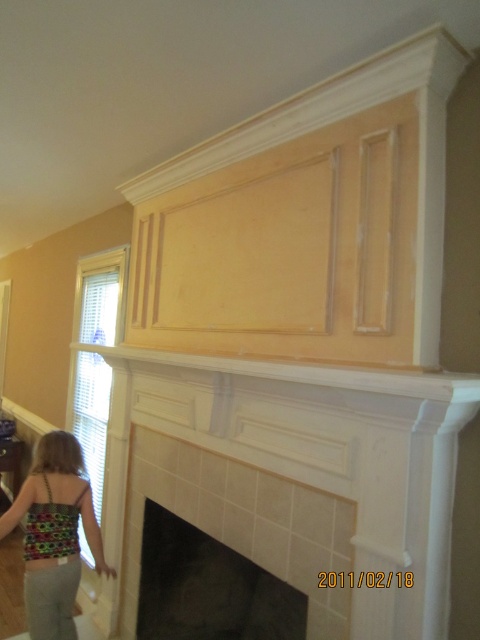
You are standing in the room and want to place a new decorative item between the black glass fireplace at center and the multicolored fabric dress at lower left. Based on their positions, which object should be on the left side of the decorative item?

The multicolored fabric dress at lower left is on the left side of the black glass fireplace at center, so the decorative item should be placed between them with the multicolored fabric dress at lower left on its left side and the black glass fireplace at center on its right side.

You are an interior designer assessing the placement of items in a room. You need to determine if the black glass fireplace at center can be moved to the location currently occupied by the multicolored fabric dress at lower left. Based on their heights, will this be possible?

The black glass fireplace at center is shorter than the multicolored fabric dress at lower left. Since the fireplace is shorter, it should fit in the space where the dress is currently placed, provided there are no other constraints like width or depth issues.

You are standing in a living room and want to place a new decorative item on the mantel. The mantel is part of the black glass fireplace at center. You have a small statue that is the same size as the multicolored fabric dress at lower left. Will the statue fit on the mantel without needing to adjust anything?

The black glass fireplace at center has a mantel that is wider than the multicolored fabric dress at lower left. Since the statue is the same size as the dress, it should fit on the mantel without needing adjustments.